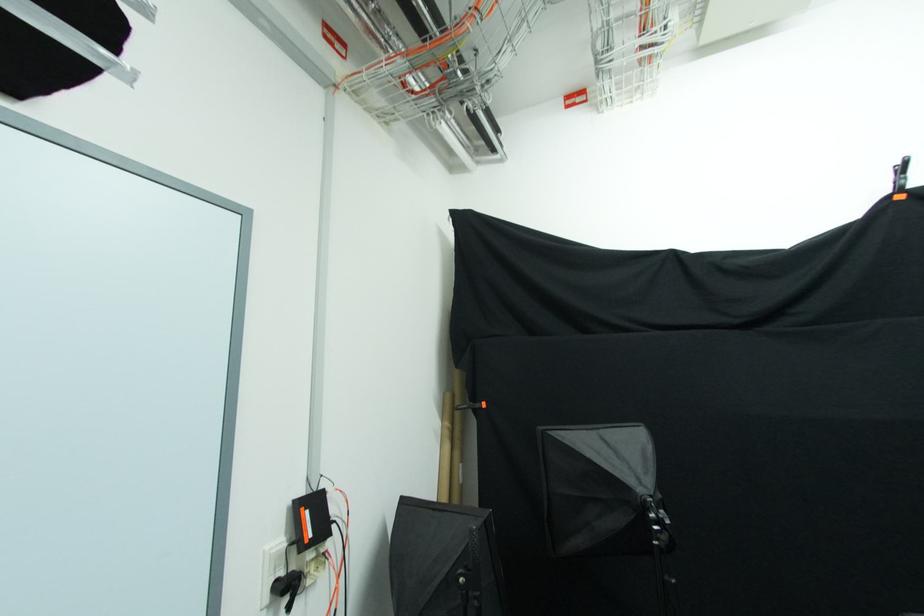
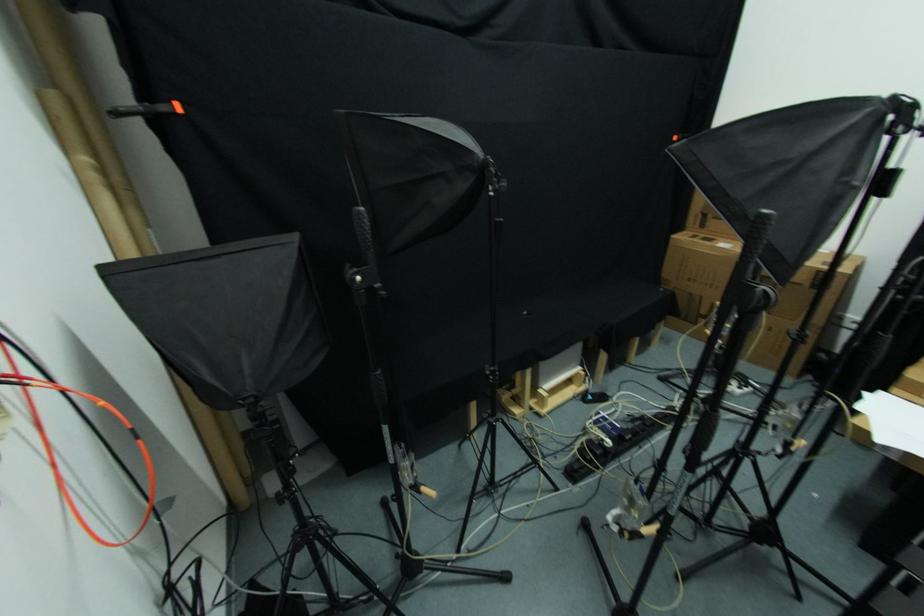
How did the camera likely rotate?

The rotation direction of the camera is right-down.